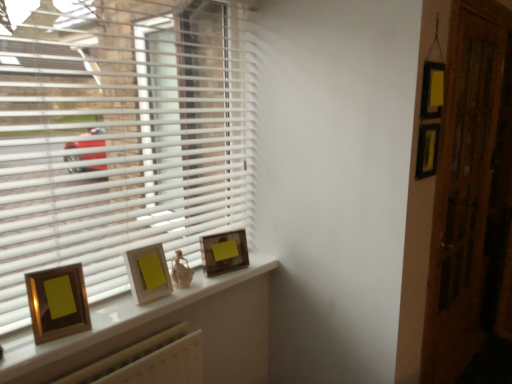
Question: Considering the relative positions of white plastic blinds at left and wooden screen door at right in the image provided, is white plastic blinds at left to the right of wooden screen door at right from the viewer's perspective?

Choices:
 (A) yes
 (B) no

Answer: (B)

Question: Is white plastic blinds at left next to wooden screen door at right and touching it?

Choices:
 (A) no
 (B) yes

Answer: (A)

Question: Could you tell me if white plastic blinds at left is turned towards wooden screen door at right?

Choices:
 (A) yes
 (B) no

Answer: (B)

Question: Does white plastic blinds at left lie in front of wooden screen door at right?

Choices:
 (A) yes
 (B) no

Answer: (A)

Question: From a real-world perspective, is white plastic blinds at left located higher than wooden screen door at right?

Choices:
 (A) yes
 (B) no

Answer: (A)

Question: Considering the relative sizes of white plastic blinds at left and wooden screen door at right in the image provided, is white plastic blinds at left bigger than wooden screen door at right?

Choices:
 (A) no
 (B) yes

Answer: (A)

Question: Considering the relative sizes of wooden glossy picture frame at left, which is counted as the 3th picture frame, starting from the back, and white plastic blinds at left in the image provided, is wooden glossy picture frame at left, which is counted as the 3th picture frame, starting from the back, thinner than white plastic blinds at left?

Choices:
 (A) no
 (B) yes

Answer: (A)

Question: Considering the relative sizes of wooden glossy picture frame at left, the 1th picture frame viewed from the front, and white plastic blinds at left in the image provided, is wooden glossy picture frame at left, the 1th picture frame viewed from the front, wider than white plastic blinds at left?

Choices:
 (A) no
 (B) yes

Answer: (B)

Question: Can you confirm if wooden glossy picture frame at left, which is the 3th picture frame from right to left, is positioned to the right of white plastic blinds at left?

Choices:
 (A) no
 (B) yes

Answer: (A)

Question: From the image's perspective, is wooden glossy picture frame at left, which is counted as the first picture frame, starting from the left, located above white plastic blinds at left?

Choices:
 (A) yes
 (B) no

Answer: (B)

Question: Is wooden glossy picture frame at left, which is the 3th picture frame from right to left, positioned behind white plastic blinds at left?

Choices:
 (A) yes
 (B) no

Answer: (A)

Question: Does wooden glossy picture frame at left, which is counted as the first picture frame, starting from the left, have a lesser height compared to white plastic blinds at left?

Choices:
 (A) yes
 (B) no

Answer: (A)

Question: Can you confirm if gold-framed picture at center is thinner than matte gold picture frame at center, the first picture frame from the back?

Choices:
 (A) no
 (B) yes

Answer: (A)